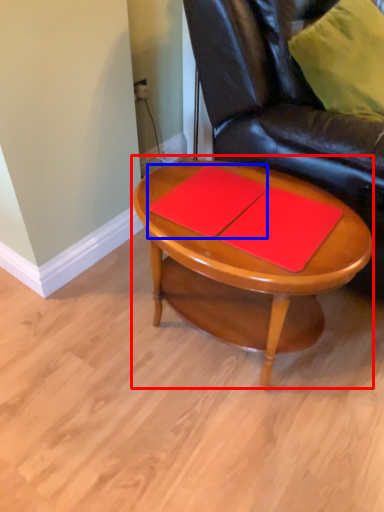
Question: Which object is further to the camera taking this photo, coffee table (highlighted by a red box) or notebook (highlighted by a blue box)?

Choices:
 (A) coffee table
 (B) notebook

Answer: (B)